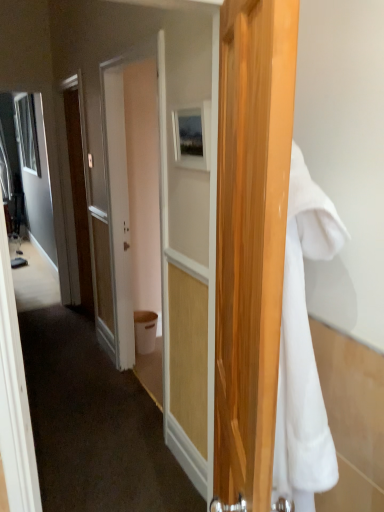
Question: Considering the relative positions of matte white door at center and white fluffy towel at right in the image provided, is matte white door at center behind white fluffy towel at right?

Choices:
 (A) no
 (B) yes

Answer: (B)

Question: From the image's perspective, is matte white door at center on top of white fluffy towel at right?

Choices:
 (A) yes
 (B) no

Answer: (A)

Question: Can you confirm if matte white door at center is wider than white fluffy towel at right?

Choices:
 (A) yes
 (B) no

Answer: (B)

Question: Are matte white door at center and white fluffy towel at right beside each other?

Choices:
 (A) yes
 (B) no

Answer: (B)

Question: Is matte white door at center facing towards white fluffy towel at right?

Choices:
 (A) no
 (B) yes

Answer: (A)

Question: Considering the relative sizes of matte white door at center and white fluffy towel at right in the image provided, is matte white door at center smaller than white fluffy towel at right?

Choices:
 (A) no
 (B) yes

Answer: (A)

Question: Does matte wooden picture frame at center have a greater height compared to matte white door at center?

Choices:
 (A) yes
 (B) no

Answer: (B)

Question: Does matte wooden picture frame at center have a lesser height compared to matte white door at center?

Choices:
 (A) yes
 (B) no

Answer: (A)

Question: Is matte wooden picture frame at center to the left of matte white door at center from the viewer's perspective?

Choices:
 (A) yes
 (B) no

Answer: (B)

Question: Is matte wooden picture frame at center touching matte white door at center?

Choices:
 (A) yes
 (B) no

Answer: (B)

Question: From a real-world perspective, is matte wooden picture frame at center located higher than matte white door at center?

Choices:
 (A) yes
 (B) no

Answer: (A)

Question: From the image's perspective, does matte wooden picture frame at center appear higher than matte white door at center?

Choices:
 (A) no
 (B) yes

Answer: (B)

Question: From a real-world perspective, does white fluffy towel at right stand above matte wooden picture frame at center?

Choices:
 (A) yes
 (B) no

Answer: (B)